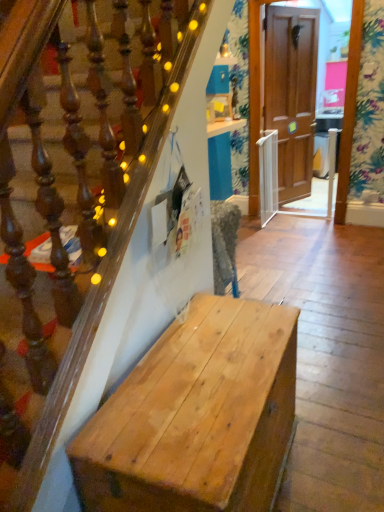
Locate an element on the screen. The image size is (384, 512). vacant point above natural wood bench at lower left (from a real-world perspective) is located at coordinates (210, 364).